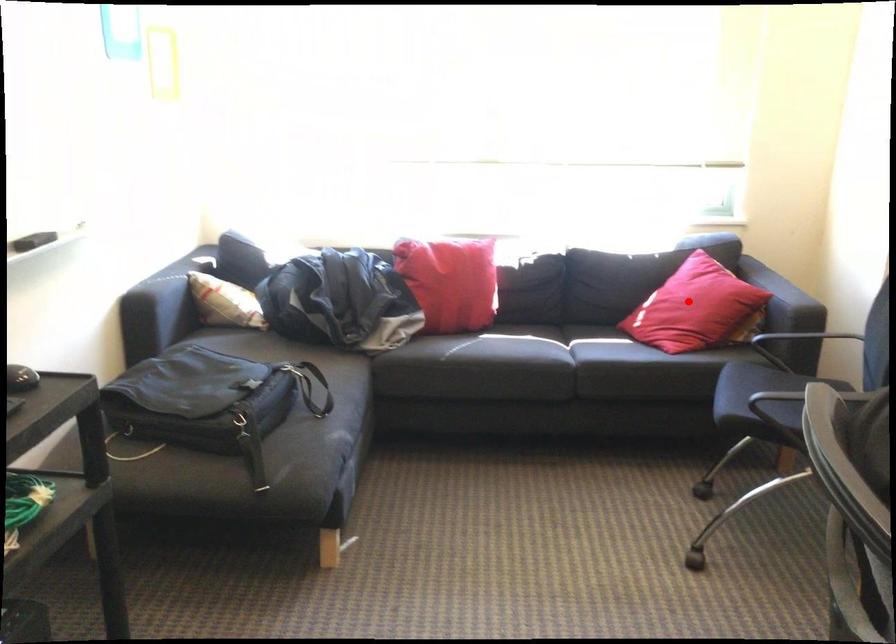
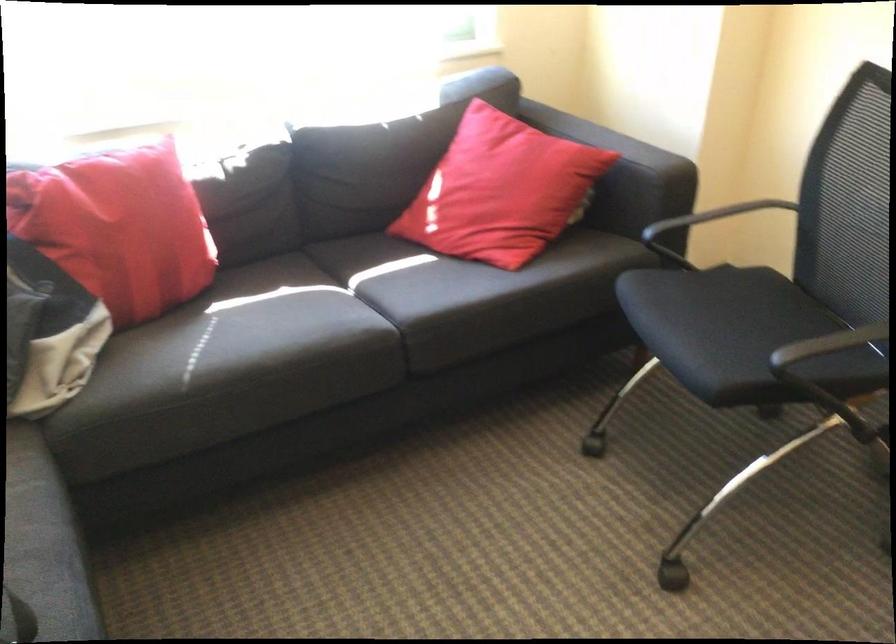
Locate, in the second image, the point that corresponds to the highlighted location in the first image.

(501, 190)